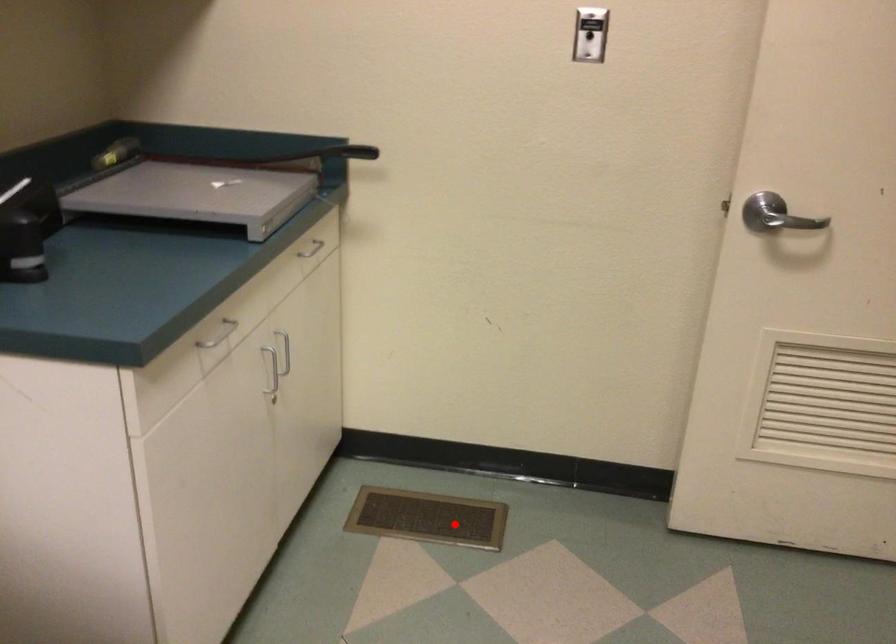
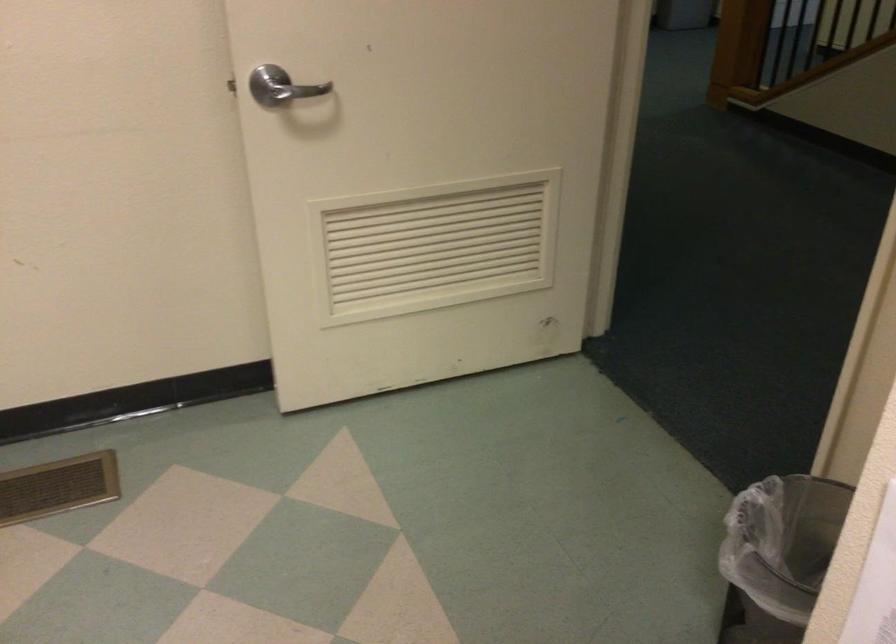
Locate, in the second image, the point that corresponds to the highlighted location in the first image.

(57, 487)